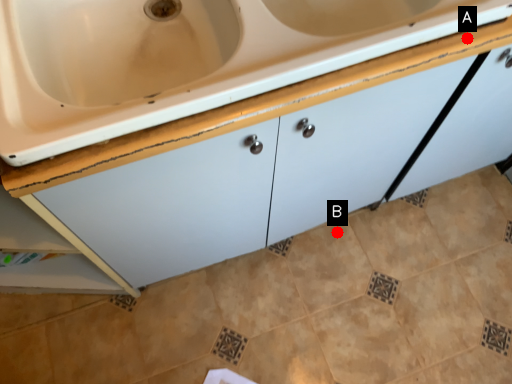
Question: Two points are circled on the image, labeled by A and B beside each circle. Which point appears closest to the camera in this image?

Choices:
 (A) A is closer
 (B) B is closer

Answer: (A)